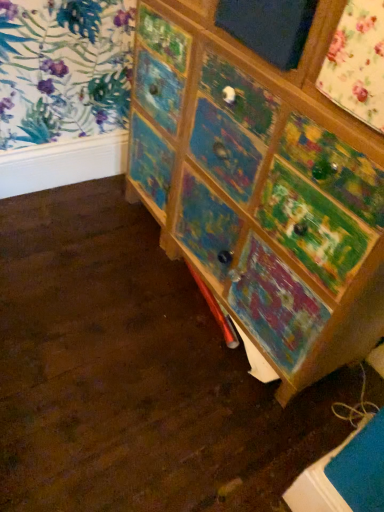
What do you see at coordinates (261, 186) in the screenshot? I see `painted wood dresser at center` at bounding box center [261, 186].

Where is `painted wood dresser at center`? painted wood dresser at center is located at coordinates (261, 186).

Where is `painted wood dresser at center`? This screenshot has width=384, height=512. painted wood dresser at center is located at coordinates (261, 186).